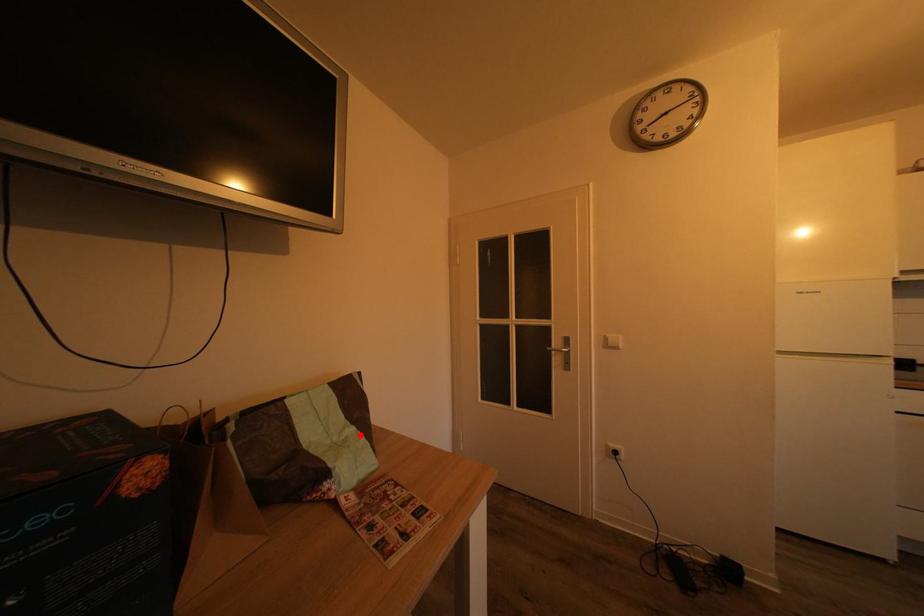
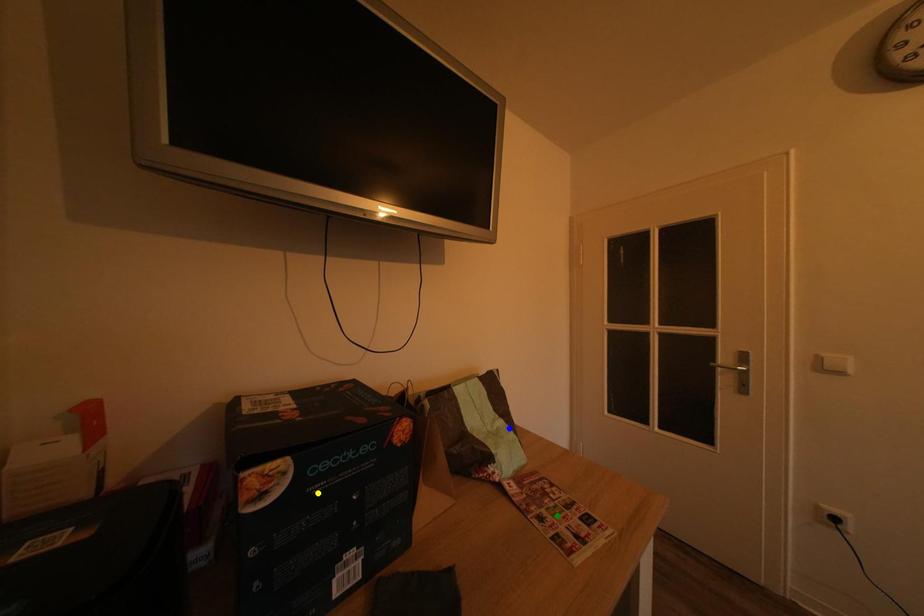
Question: I am providing you with two images of the same scene from different viewpoints. A red point is marked on the first image. You are given multiple points on the second image. In image 2, which mark is for the same physical point as the one in image 1?

Choices:
 (A) blue point
 (B) green point
 (C) yellow point

Answer: (A)